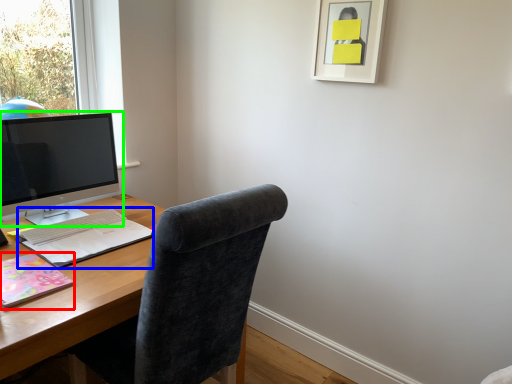
Question: Which object is the farthest from notebook (highlighted by a red box)? Choose among these: notebook (highlighted by a blue box) or computer monitor (highlighted by a green box).

Choices:
 (A) notebook
 (B) computer monitor

Answer: (B)